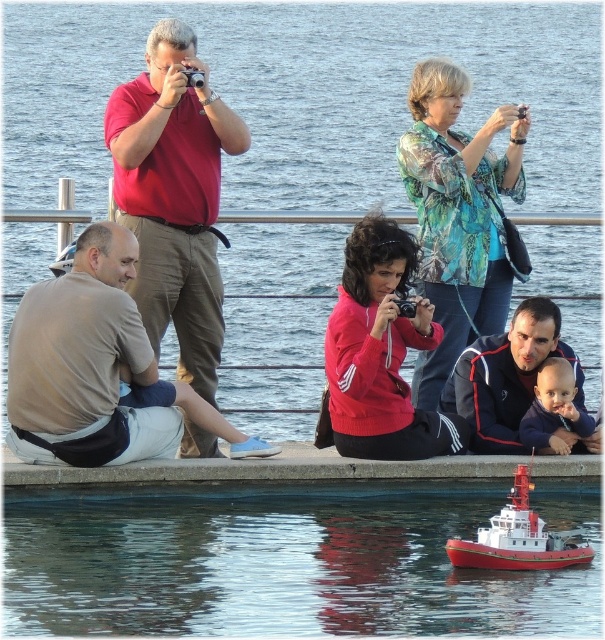
Question: Can you confirm if transparent water at lower center is bigger than printed fabric blouse at upper center?

Choices:
 (A) yes
 (B) no

Answer: (A)

Question: Which point is farther to the camera?

Choices:
 (A) (355, 129)
 (B) (433, 116)
 (C) (526, 448)

Answer: (A)

Question: Does transparent water at lower center appear on the left side of brown cotton t-shirt at lower left?

Choices:
 (A) no
 (B) yes

Answer: (A)

Question: Which object is the closest to the matte red shirt at upper left?

Choices:
 (A) dark blue fleece at lower right
 (B) brown cotton t-shirt at lower left
 (C) transparent water at lower center

Answer: (B)

Question: Can you confirm if red matte jacket at center is positioned below concrete ledge at lower center?

Choices:
 (A) yes
 (B) no

Answer: (B)

Question: Which point is farther from the camera taking this photo?

Choices:
 (A) (162, 394)
 (B) (531, 566)

Answer: (A)